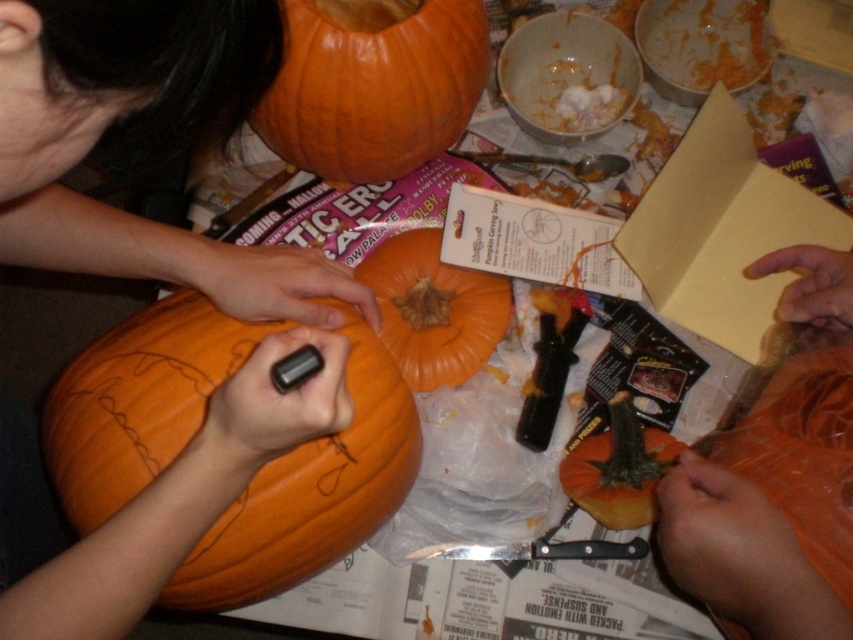
Does orange matte pumpkin at lower left come in front of orange matte pumpkin at upper center?

No, orange matte pumpkin at lower left is behind orange matte pumpkin at upper center.

Which is in front, point (199, 364) or point (474, 0)?

Point (199, 364) is in front.

You are a GUI agent. You are given a task and a screenshot of the screen. Output one action in this format:
    pyautogui.click(x=<x>, y=<y>)
    Task: Click on the orange matte pumpkin at lower left
    
    Given the screenshot: What is the action you would take?
    pyautogui.click(x=311, y=492)

Is the position of orange matte pumpkin at lower left more distant than that of smooth orange pumpkin at lower right?

Yes, it is behind smooth orange pumpkin at lower right.

Can you confirm if orange matte pumpkin at lower left is positioned to the right of smooth orange pumpkin at lower right?

In fact, orange matte pumpkin at lower left is to the left of smooth orange pumpkin at lower right.

Which is in front, point (222, 374) or point (669, 472)?

Point (222, 374)

The height and width of the screenshot is (640, 853). I want to click on orange matte pumpkin at lower left, so click(311, 492).

Which is in front, point (259, 284) or point (264, 132)?

Point (259, 284) is in front.

The image size is (853, 640). What do you see at coordinates (131, 113) in the screenshot? I see `smooth orange pumpkin at center` at bounding box center [131, 113].

Between point (84, 68) and point (474, 93), which one is positioned in front?

Point (84, 68)

What are the coordinates of `smooth orange pumpkin at center` in the screenshot? It's located at (131, 113).